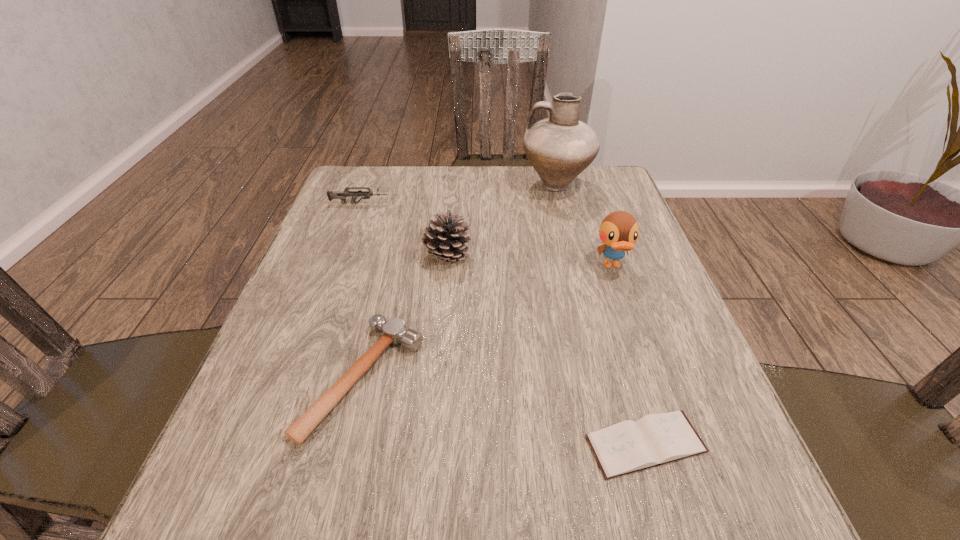
This screenshot has height=540, width=960. Identify the location of free location located 0.160m on the front of the pinecone. (442, 327).

I want to click on free location located 0.200m aimed along the barrel of the gun, so click(x=465, y=204).

Locate an element on the screen. The image size is (960, 540). free space located on the back of the fifth tallest object is located at coordinates (392, 257).

Image resolution: width=960 pixels, height=540 pixels. Find the location of `blank area located on the left of the shortest object`. blank area located on the left of the shortest object is located at coordinates (526, 444).

The height and width of the screenshot is (540, 960). In order to click on pitcher located in the far edge section of the desktop in this screenshot , I will do `click(559, 148)`.

The width and height of the screenshot is (960, 540). Find the location of `gun that is at the far edge`. gun that is at the far edge is located at coordinates (341, 195).

At what (x,y) coordinates should I click in order to perform the action: click on object that is at the near edge. Please return your answer as a coordinate pair (x, y). Image resolution: width=960 pixels, height=540 pixels. Looking at the image, I should click on (629, 446).

Find the location of a particular element. The height and width of the screenshot is (540, 960). gun at the left edge is located at coordinates (341, 195).

Locate an element on the screen. Image resolution: width=960 pixels, height=540 pixels. hammer situated at the left edge is located at coordinates (394, 331).

Identify the location of pitcher present at the right edge. The image size is (960, 540). (559, 148).